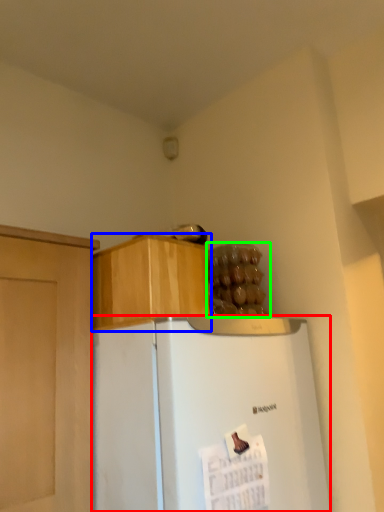
Question: Which object is the farthest from refrigerator (highlighted by a red box)? Choose among these: cabinetry (highlighted by a blue box) or food (highlighted by a green box).

Choices:
 (A) cabinetry
 (B) food

Answer: (B)